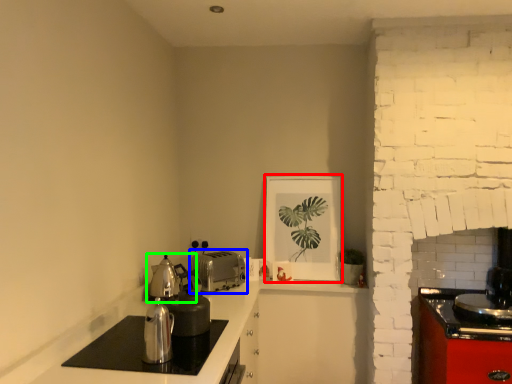
Question: Which is farther away from picture frame (highlighted by a red box)? toaster (highlighted by a blue box) or tea pot (highlighted by a green box)?

Choices:
 (A) toaster
 (B) tea pot

Answer: (B)